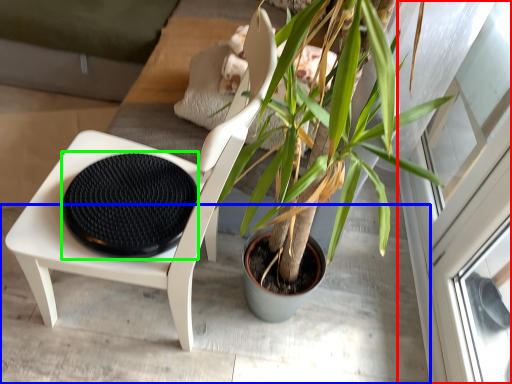
Question: Based on their relative distances, which object is nearer to screen door (highlighted by a red box)? Choose from concrete (highlighted by a blue box) and footrest (highlighted by a green box).

Choices:
 (A) concrete
 (B) footrest

Answer: (A)